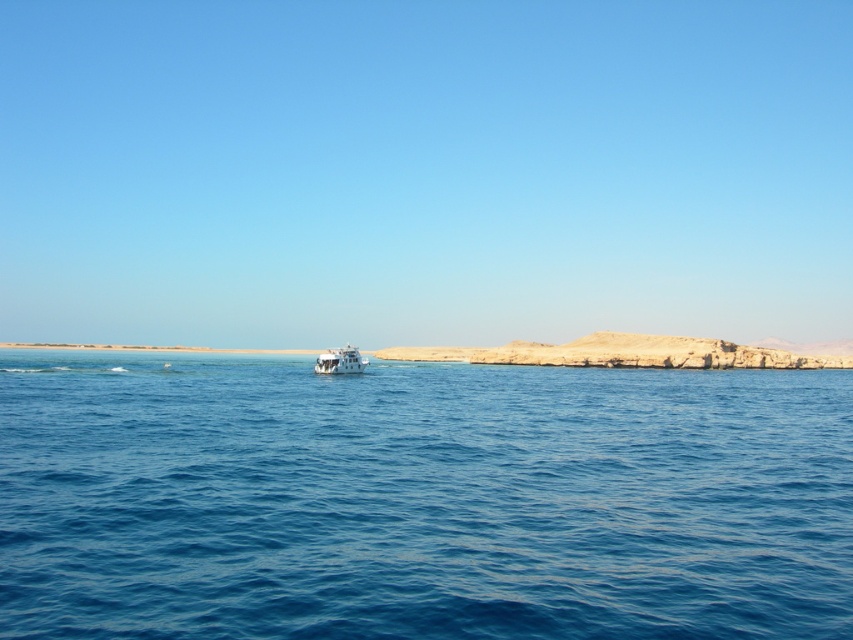
Between white rocky coast at center and white glossy boat at center, which one is positioned lower?

Positioned lower is white rocky coast at center.

Does white rocky coast at center come behind white glossy boat at center?

Yes, it is behind white glossy boat at center.

Is point (631, 355) behind point (328, 356)?

That is True.

Find the location of a particular element. This screenshot has width=853, height=640. white rocky coast at center is located at coordinates (625, 353).

Can you confirm if blue water at center is smaller than white rocky coast at center?

Yes, blue water at center is smaller than white rocky coast at center.

The width and height of the screenshot is (853, 640). What do you see at coordinates (419, 499) in the screenshot? I see `blue water at center` at bounding box center [419, 499].

Is point (509, 458) closer to camera compared to point (440, 355)?

Yes, it is.

You are a GUI agent. You are given a task and a screenshot of the screen. Output one action in this format:
    pyautogui.click(x=<x>, y=<y>)
    Task: Click on the blue water at center
    
    Given the screenshot: What is the action you would take?
    pyautogui.click(x=419, y=499)

Is blue water at center to the left of white glossy boat at center from the viewer's perspective?

In fact, blue water at center is to the right of white glossy boat at center.

Looking at this image, does blue water at center lie behind white glossy boat at center?

No.

Where is `blue water at center`? blue water at center is located at coordinates (419, 499).